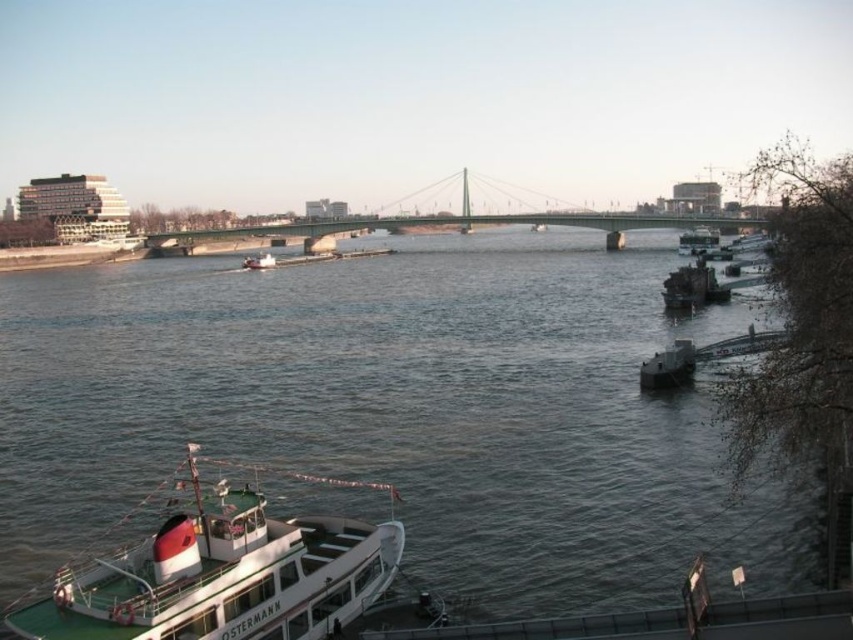
You are a photographer planning to take a wide shot of the smooth water at center and the white matte boat at lower left. Given their sizes, which one should you focus on to ensure it takes up more of the frame?

The smooth water at center should be focused on since it has a larger size compared to the white matte boat at lower left, ensuring it occupies more of the frame.

In the scene shown: You are standing on the pier in the bottom right corner and want to board the dark gray metallic boat at lower right. Is the boat positioned close enough to the pier for you to easily step onto it?

The dark gray metallic boat at lower right is located at point (668, 365), which is very close to the pier, so you can easily step onto it from the pier in the bottom right corner.

You are a passenger on the white matte boat at center and want to move to the dark gray metallic boat at lower right. Which direction should you go to reach it?

The dark gray metallic boat at lower right is positioned on the right side of the white matte boat at center, so you should go to the right to reach it.